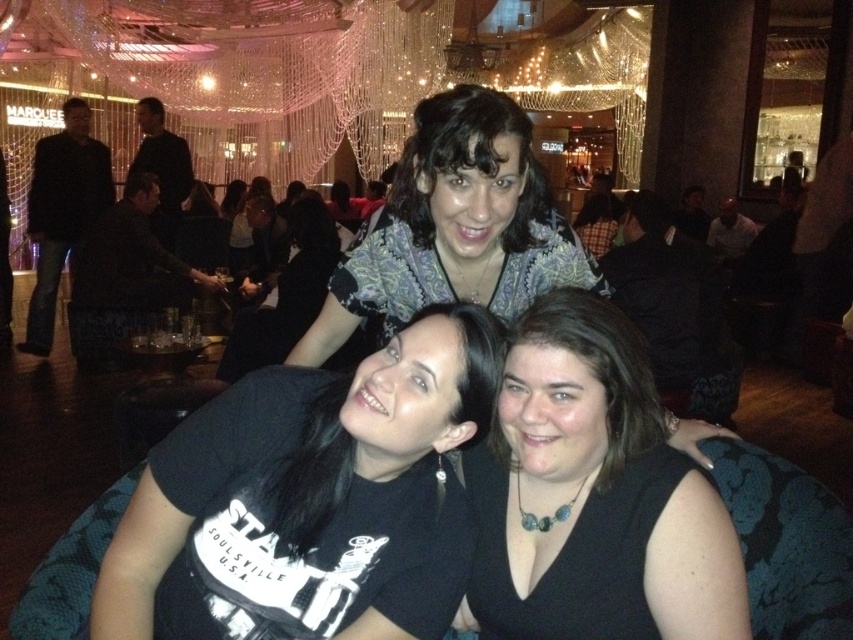
You are a photographer trying to capture a closeup of the two points in the image. Which point, point (219, 621) or point (434, 170), is closer to your camera lens?

Point (219, 621) is closer to the camera lens than point (434, 170).

You are at a social event and want to take a photo of the patterned fabric scarf at upper center and the matte black shirt at center. Which object is located lower in the image?

The patterned fabric scarf at upper center is positioned under the matte black shirt at center, so the scarf is lower than the shirt in the image.

You are organizing a photo shoot and need to ensure that the patterned fabric scarf at upper center and the matte black shirt at center are both visible in the frame. Given their sizes, which object might require closer attention to ensure it doesn not get lost in the composition?

The patterned fabric scarf at upper center is smaller than the matte black shirt at center, so it might require closer attention to ensure it doesn not get lost in the composition.